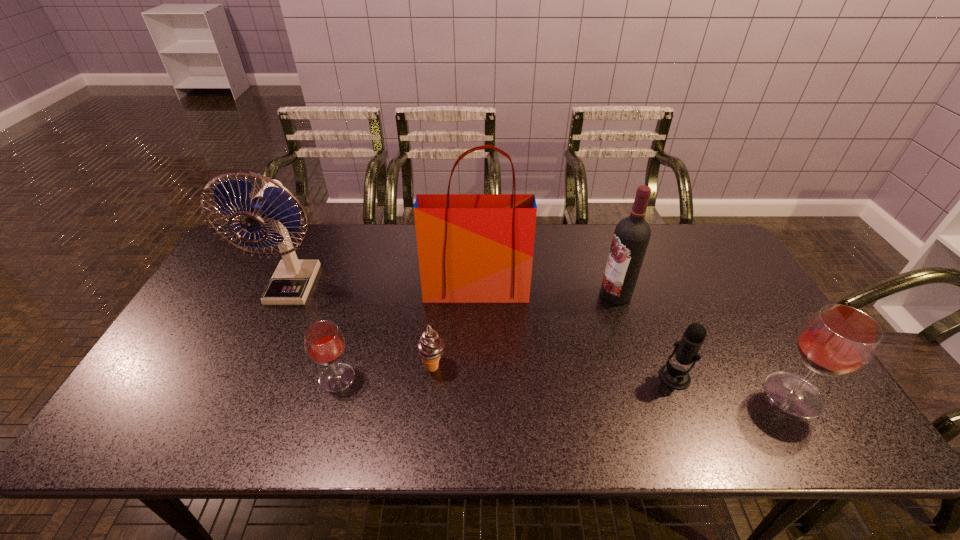
Image resolution: width=960 pixels, height=540 pixels. In order to click on free location that satisfies the following two spatial constraints: 1. on the front-facing side of the leftmost object; 2. on the left side of the microphone in this screenshot , I will do `click(251, 377)`.

Where is `free region that satisfies the following two spatial constraints: 1. on the front-facing side of the right wineglass; 2. on the right side of the leftmost object`? This screenshot has width=960, height=540. free region that satisfies the following two spatial constraints: 1. on the front-facing side of the right wineglass; 2. on the right side of the leftmost object is located at coordinates (243, 395).

Identify the location of vacant space that satisfies the following two spatial constraints: 1. on the label of the wine bottle; 2. on the left side of the microphone. The image size is (960, 540). (642, 377).

Locate an element on the screen. The height and width of the screenshot is (540, 960). blank space that satisfies the following two spatial constraints: 1. on the label of the microphone; 2. on the left side of the wine bottle is located at coordinates (642, 377).

I want to click on vacant region that satisfies the following two spatial constraints: 1. on the handle side of the shopping bag; 2. on the left side of the microphone, so click(x=475, y=377).

The width and height of the screenshot is (960, 540). Find the location of `free location that satisfies the following two spatial constraints: 1. on the label of the fourth tallest object; 2. on the left side of the wine bottle`. free location that satisfies the following two spatial constraints: 1. on the label of the fourth tallest object; 2. on the left side of the wine bottle is located at coordinates (649, 395).

I want to click on free space that satisfies the following two spatial constraints: 1. on the back side of the taller wineglass; 2. on the label of the wine bottle, so (x=732, y=294).